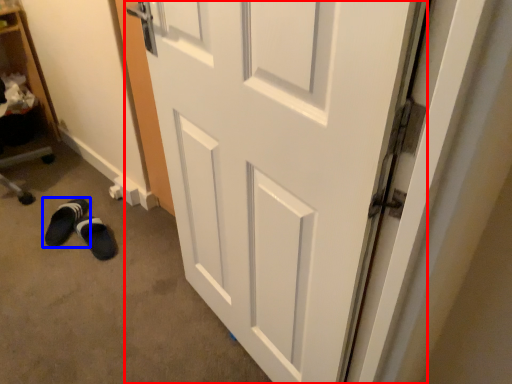
Question: Which point is closer to the camera, door (highlighted by a red box) or footwear (highlighted by a blue box)?

Choices:
 (A) door
 (B) footwear

Answer: (A)